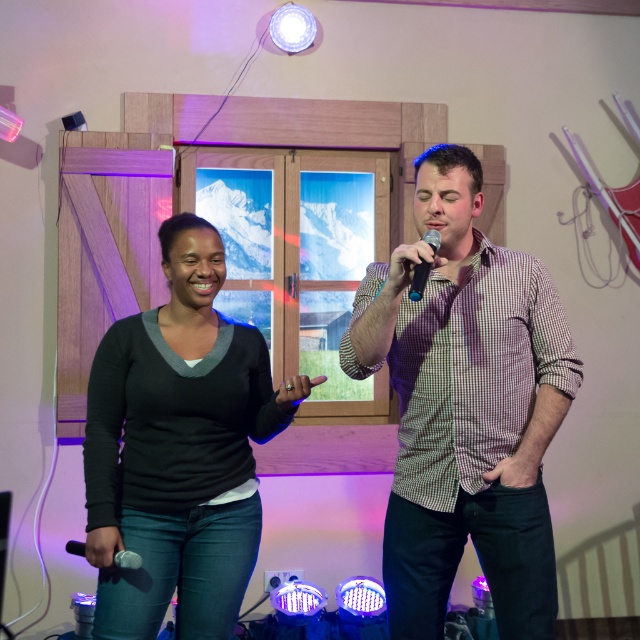
Is checkered fabric shirt at center to the left of black matte sweater at center from the viewer's perspective?

Incorrect, checkered fabric shirt at center is not on the left side of black matte sweater at center.

You are a GUI agent. You are given a task and a screenshot of the screen. Output one action in this format:
    pyautogui.click(x=<x>, y=<y>)
    Task: Click on the checkered fabric shirt at center
    This screenshot has width=640, height=640.
    Given the screenshot: What is the action you would take?
    pyautogui.click(x=465, y=406)

I want to click on checkered fabric shirt at center, so click(465, 406).

Measure the distance between matte black shirt at center and black matte microphone at center.

The distance of matte black shirt at center from black matte microphone at center is 34.84 centimeters.

What do you see at coordinates (465, 406) in the screenshot? Image resolution: width=640 pixels, height=640 pixels. I see `matte black shirt at center` at bounding box center [465, 406].

Who is more forward, (476, 440) or (416, 296)?

Positioned in front is point (416, 296).

This screenshot has width=640, height=640. I want to click on matte black shirt at center, so click(x=465, y=406).

Who is more forward, (556, 356) or (413, 298)?

Point (413, 298) is in front.

Can you confirm if checkered fabric shirt at center is taller than black matte microphone at center?

Indeed, checkered fabric shirt at center has a greater height compared to black matte microphone at center.

Measure the distance between checkered fabric shirt at center and camera.

checkered fabric shirt at center is 6.07 feet from camera.

Identify the location of checkered fabric shirt at center. (465, 406).